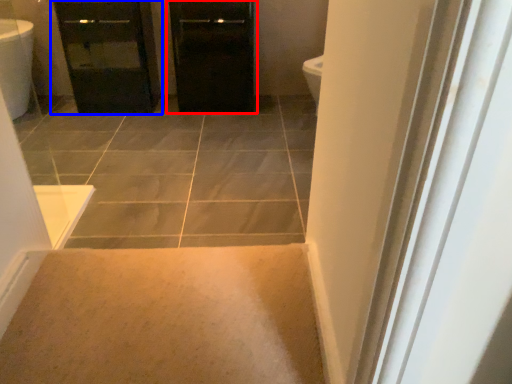
Question: Which object is further to the camera taking this photo, door (highlighted by a red box) or bathroom cabinet (highlighted by a blue box)?

Choices:
 (A) door
 (B) bathroom cabinet

Answer: (A)